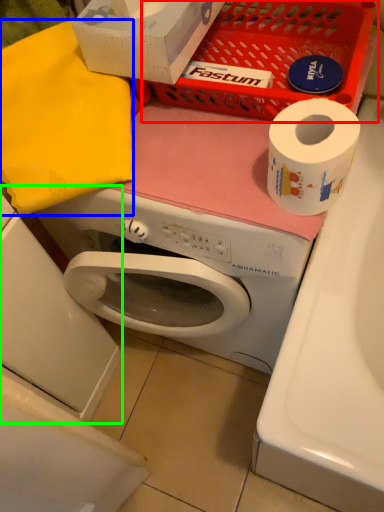
Question: Which object is positioned closest to basket (highlighted by a red box)? Select from clothe (highlighted by a blue box) and machine (highlighted by a green box).

Choices:
 (A) clothe
 (B) machine

Answer: (A)